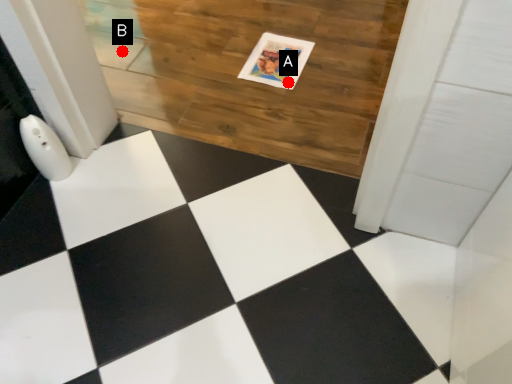
Question: Two points are circled on the image, labeled by A and B beside each circle. Which of the following is the farthest from the observer?

Choices:
 (A) A is further
 (B) B is further

Answer: (B)